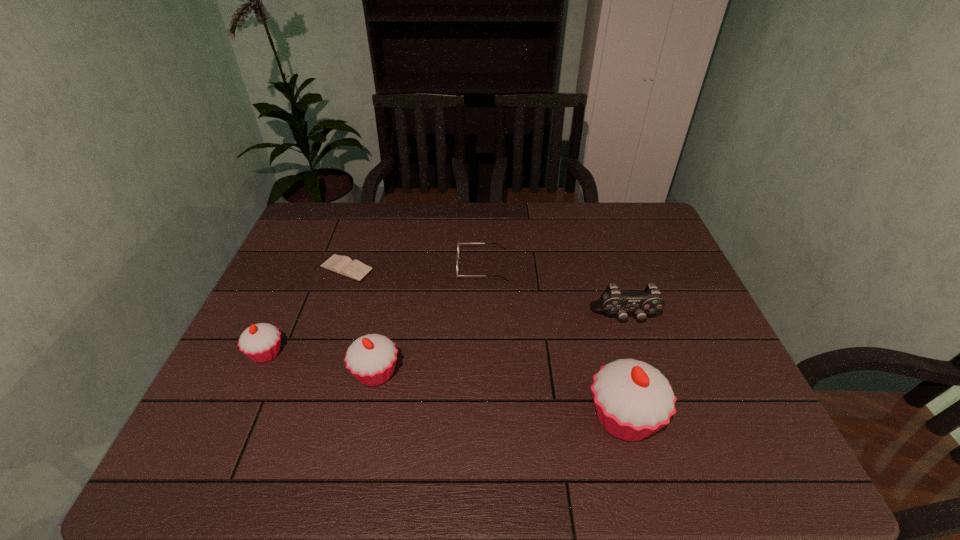
Locate an element on the screen. The height and width of the screenshot is (540, 960). vacant area situated 0.300m on the right of the third object from left to right is located at coordinates (526, 373).

The image size is (960, 540). I want to click on vacant space situated on the back of the tallest object, so click(591, 297).

Where is `free space located 0.200m on the surface of the control with buttons`? free space located 0.200m on the surface of the control with buttons is located at coordinates (651, 395).

Image resolution: width=960 pixels, height=540 pixels. Find the location of `free space located 0.320m on the front-facing side of the second shortest object`. free space located 0.320m on the front-facing side of the second shortest object is located at coordinates (351, 266).

This screenshot has width=960, height=540. What are the coordinates of `vacant position located 0.090m on the front-facing side of the second shortest object` in the screenshot? It's located at (427, 266).

Locate an element on the screen. This screenshot has height=540, width=960. vacant space located on the front-facing side of the second shortest object is located at coordinates (384, 266).

Locate an element on the screen. The width and height of the screenshot is (960, 540). free spot located on the right of the diary is located at coordinates (503, 268).

You are a GUI agent. You are given a task and a screenshot of the screen. Output one action in this format:
    pyautogui.click(x=<x>, y=<y>)
    Task: Click on the cupcake that is at the left edge
    The image size is (960, 540).
    Given the screenshot: What is the action you would take?
    pyautogui.click(x=260, y=342)

Where is `diary at the left edge`? diary at the left edge is located at coordinates click(343, 265).

The width and height of the screenshot is (960, 540). What are the coordinates of `object that is at the right edge` in the screenshot? It's located at (613, 301).